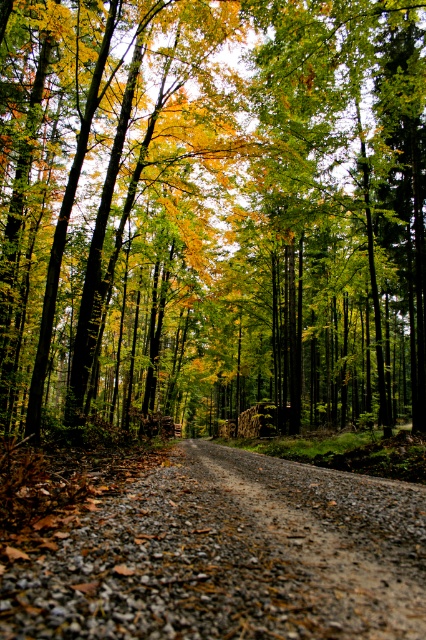
Question: Where is golden leafy trees at center located in relation to gray gravel road at center in the image?

Choices:
 (A) above
 (B) below

Answer: (A)

Question: Among these points, which one is nearest to the camera?

Choices:
 (A) (314, 632)
 (B) (244, 188)

Answer: (A)

Question: Does golden leafy trees at center appear under gray gravel road at center?

Choices:
 (A) yes
 (B) no

Answer: (B)

Question: Is golden leafy trees at center further to the viewer compared to gray gravel road at center?

Choices:
 (A) yes
 (B) no

Answer: (A)